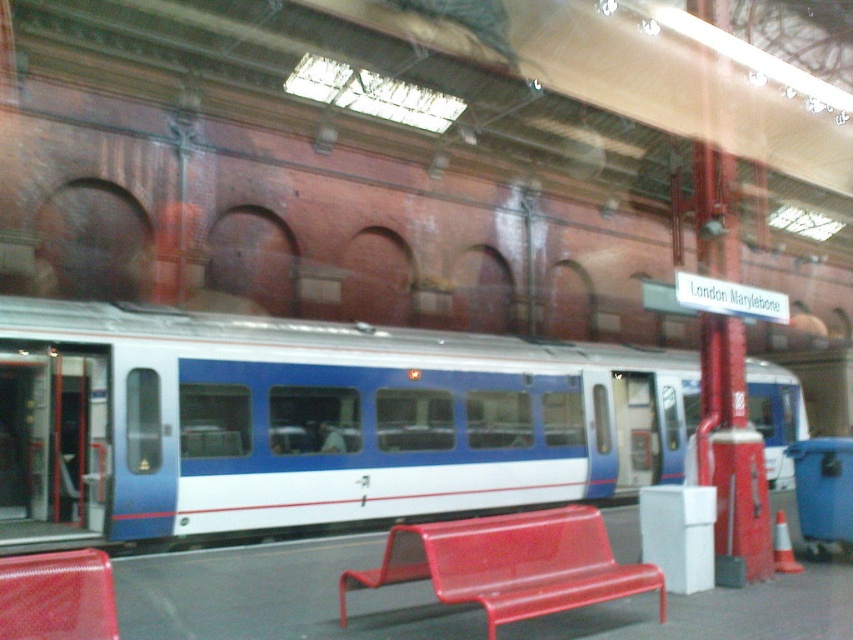
You are a passenger waiting for your train at the London Marylebone station. You see the metallic red bench at lower center and the rubberized red bench at lower left. Which bench is closer to the train doors that are open?

The metallic red bench at lower center is positioned under the rubberized red bench at lower left, so the metallic red bench at lower center is closer to the open train doors.

You are a passenger waiting for the train and want to sit down. You see the metallic red bench at lower center and the rubberized red bench at lower left. Which bench is shorter?

The metallic red bench at lower center has a lesser height compared to the rubberized red bench at lower left, so the metallic red bench at lower center is shorter.